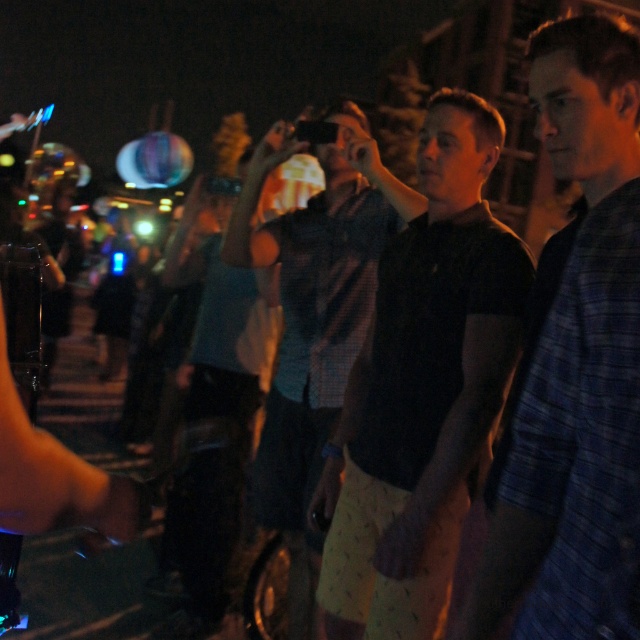
Who is taller, black matte shorts at center or blue plaid shirt at center?

Standing taller between the two is black matte shorts at center.

This screenshot has height=640, width=640. Find the location of `black matte shorts at center`. black matte shorts at center is located at coordinates (420, 388).

In order to click on black matte shorts at center in this screenshot , I will do `click(420, 388)`.

Is plaid shirt at center shorter than dark plaid shirt at center?

Correct, plaid shirt at center is not as tall as dark plaid shirt at center.

Does plaid shirt at center appear on the left side of dark plaid shirt at center?

Incorrect, plaid shirt at center is not on the left side of dark plaid shirt at center.

Does point (280, 131) come behind point (193, 209)?

No.

Image resolution: width=640 pixels, height=640 pixels. Find the location of `plaid shirt at center`. plaid shirt at center is located at coordinates (314, 317).

You are a GUI agent. You are given a task and a screenshot of the screen. Output one action in this format:
    pyautogui.click(x=<x>, y=<y>)
    Task: Click on the black matte shorts at center
    The height and width of the screenshot is (640, 640).
    Given the screenshot: What is the action you would take?
    pyautogui.click(x=420, y=388)

Based on the photo, is black matte shorts at center above plaid shirt at center?

No.

Is point (508, 316) closer to viewer compared to point (304, 508)?

Yes.

Find the location of a particular element. The height and width of the screenshot is (640, 640). black matte shorts at center is located at coordinates (420, 388).